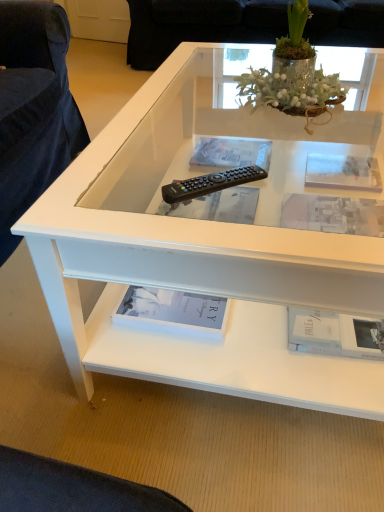
Question: From the image's perspective, is clear plastic book at center, which is counted as the 5th book, starting from the front, under transparent glass frame at upper center?

Choices:
 (A) yes
 (B) no

Answer: (B)

Question: From a real-world perspective, is clear plastic book at center, which is counted as the 5th book, starting from the front, on transparent glass frame at upper center?

Choices:
 (A) no
 (B) yes

Answer: (B)

Question: Considering the relative positions of clear plastic book at center, which is counted as the 5th book, starting from the front, and transparent glass frame at upper center in the image provided, is clear plastic book at center, which is counted as the 5th book, starting from the front, to the left of transparent glass frame at upper center from the viewer's perspective?

Choices:
 (A) no
 (B) yes

Answer: (B)

Question: Is clear plastic book at center, which is counted as the 5th book, starting from the front, next to transparent glass frame at upper center and touching it?

Choices:
 (A) no
 (B) yes

Answer: (A)

Question: Is clear plastic book at center, which is counted as the 5th book, starting from the front, closer to the viewer compared to transparent glass frame at upper center?

Choices:
 (A) yes
 (B) no

Answer: (B)

Question: Considering their positions, is green glass vase at upper center located in front of or behind matte black remote control at center, positioned as the 4th book in front-to-back order?

Choices:
 (A) front
 (B) behind

Answer: (A)

Question: From the image's perspective, is green glass vase at upper center positioned above or below matte black remote control at center, which is the second book in back-to-front order?

Choices:
 (A) below
 (B) above

Answer: (B)

Question: In the image, is green glass vase at upper center on the left side or the right side of matte black remote control at center, which is the second book in back-to-front order?

Choices:
 (A) right
 (B) left

Answer: (A)

Question: Considering the positions of green glass vase at upper center and matte black remote control at center, which is the second book in back-to-front order, in the image, is green glass vase at upper center wider or thinner than matte black remote control at center, which is the second book in back-to-front order,?

Choices:
 (A) wide
 (B) thin

Answer: (A)

Question: From the image's perspective, is white matte book at upper right, acting as the 3th book starting from the front, above or below white glossy coffee table at center?

Choices:
 (A) above
 (B) below

Answer: (B)

Question: Looking at their shapes, would you say white matte book at upper right, positioned as the third book in back-to-front order, is wider or thinner than white glossy coffee table at center?

Choices:
 (A) thin
 (B) wide

Answer: (A)

Question: From a real-world perspective, is white matte book at upper right, positioned as the third book in back-to-front order, positioned above or below white glossy coffee table at center?

Choices:
 (A) above
 (B) below

Answer: (A)

Question: Considering the positions of white matte book at upper right, positioned as the third book in back-to-front order, and white glossy coffee table at center in the image, is white matte book at upper right, positioned as the third book in back-to-front order, bigger or smaller than white glossy coffee table at center?

Choices:
 (A) small
 (B) big

Answer: (A)

Question: Considering the positions of white matte book at lower right, the 5th book when ordered from back to front, and transparent glass frame at upper center in the image, is white matte book at lower right, the 5th book when ordered from back to front, wider or thinner than transparent glass frame at upper center?

Choices:
 (A) wide
 (B) thin

Answer: (A)

Question: In the image, is white matte book at lower right, the 5th book when ordered from back to front, positioned in front of or behind transparent glass frame at upper center?

Choices:
 (A) behind
 (B) front

Answer: (B)